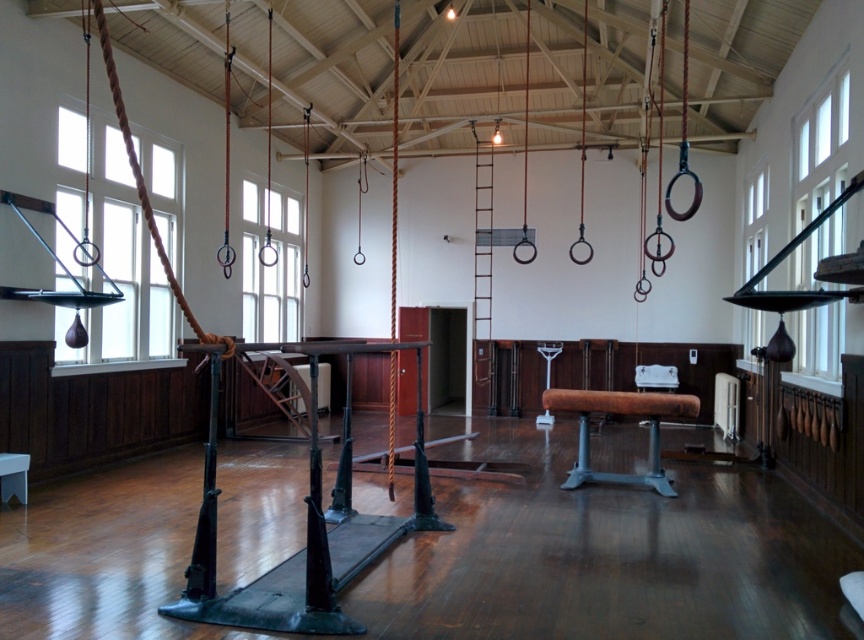
You are a gymnast standing at the origin point of the gymnasium floor. The gymnasium floor is a coordinate grid where the bottom left corner is the origin point. You want to move to the brown leather beam at center. What are the coordinates you need to navigate to?

The coordinates you need to navigate to are 0.630 on the x axis and 0.720 on the y axis.

You are a gymnast preparing for a routine and need to move from the brown leather beam at center to the metallic stool at lower left. Given that your maximum reach is 2 meters, can you safely jump from the beam to the stool without needing assistance?

The distance between the brown leather beam at center and the metallic stool at lower left is 6.42 meters. Since your maximum reach is only 2 meters, you cannot safely jump from the beam to the stool without assistance.